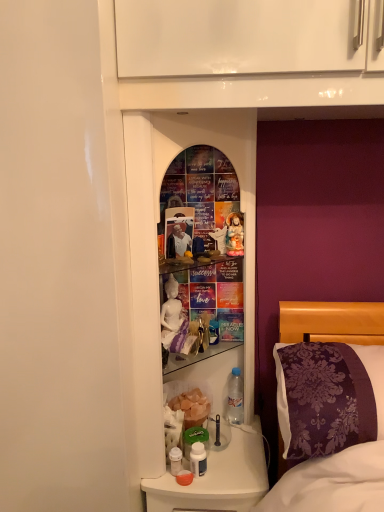
Question: Is translucent plastic bottles at lower center bigger than clear plastic bottle at lower center, arranged as the 1th bottle when viewed from the right?

Choices:
 (A) yes
 (B) no

Answer: (A)

Question: Is clear plastic bottle at lower center, the 2th bottle positioned from the left, at the back of translucent plastic bottles at lower center?

Choices:
 (A) no
 (B) yes

Answer: (A)

Question: Considering the relative positions of translucent plastic bottles at lower center and clear plastic bottle at lower center, the 2th bottle positioned from the left, in the image provided, is translucent plastic bottles at lower center to the right of clear plastic bottle at lower center, the 2th bottle positioned from the left, from the viewer's perspective?

Choices:
 (A) no
 (B) yes

Answer: (A)

Question: Considering the relative positions of translucent plastic bottles at lower center and clear plastic bottle at lower center, the 1th bottle viewed from the back, in the image provided, is translucent plastic bottles at lower center behind clear plastic bottle at lower center, the 1th bottle viewed from the back,?

Choices:
 (A) yes
 (B) no

Answer: (B)

Question: Is translucent plastic bottles at lower center closer to camera compared to clear plastic bottle at lower center, the 2th bottle positioned from the left?

Choices:
 (A) no
 (B) yes

Answer: (B)

Question: Considering the positions of matte white photo frame at center and translucent plastic bottles at lower center in the image, is matte white photo frame at center taller or shorter than translucent plastic bottles at lower center?

Choices:
 (A) short
 (B) tall

Answer: (A)

Question: From the image's perspective, is matte white photo frame at center above or below translucent plastic bottles at lower center?

Choices:
 (A) below
 (B) above

Answer: (B)

Question: Is matte white photo frame at center in front of or behind translucent plastic bottles at lower center in the image?

Choices:
 (A) front
 (B) behind

Answer: (B)

Question: From a real-world perspective, is matte white photo frame at center above or below translucent plastic bottles at lower center?

Choices:
 (A) above
 (B) below

Answer: (A)

Question: Visually, is purple damask pillow at right positioned to the left or to the right of translucent plastic bottles at lower center?

Choices:
 (A) left
 (B) right

Answer: (B)

Question: From the image's perspective, relative to translucent plastic bottles at lower center, is purple damask pillow at right above or below?

Choices:
 (A) above
 (B) below

Answer: (A)

Question: In terms of size, does purple damask pillow at right appear bigger or smaller than translucent plastic bottles at lower center?

Choices:
 (A) big
 (B) small

Answer: (B)

Question: In terms of width, does purple damask pillow at right look wider or thinner when compared to translucent plastic bottles at lower center?

Choices:
 (A) thin
 (B) wide

Answer: (B)

Question: Considering the positions of clear plastic bottle at lower center, the 2th bottle positioned from the left, and purple damask pillow at right in the image, is clear plastic bottle at lower center, the 2th bottle positioned from the left, wider or thinner than purple damask pillow at right?

Choices:
 (A) wide
 (B) thin

Answer: (B)

Question: Considering the positions of point (236, 395) and point (311, 352), is point (236, 395) closer or farther from the camera than point (311, 352)?

Choices:
 (A) farther
 (B) closer

Answer: (A)